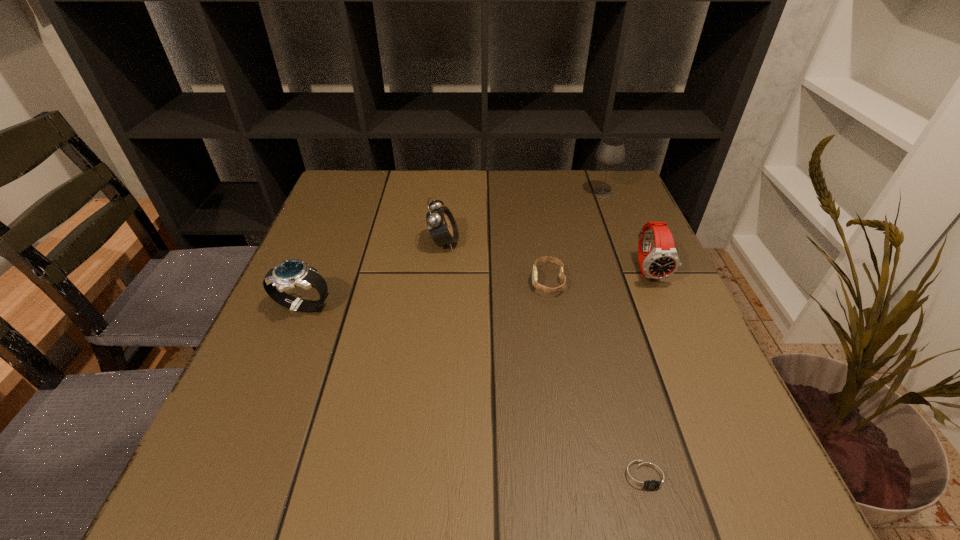
Locate an element on the screen. The height and width of the screenshot is (540, 960). wineglass that is at the right edge is located at coordinates (611, 152).

Locate an element on the screen. This screenshot has width=960, height=540. object that is at the far right corner is located at coordinates (611, 152).

This screenshot has width=960, height=540. I want to click on object present at the near right corner, so click(x=645, y=476).

Where is `vacant space at the far edge`? vacant space at the far edge is located at coordinates (495, 194).

Identify the location of free region at the near edge of the desktop. (541, 472).

At what (x,y) coordinates should I click in order to perform the action: click on vacant space at the left edge of the desktop. Please return your answer as a coordinate pair (x, y). This screenshot has height=540, width=960. Looking at the image, I should click on (311, 444).

In the image, there is a desktop. Identify the location of free space at the right edge. (672, 390).

At what (x,y) coordinates should I click in order to perform the action: click on vacant space at the far left corner of the desktop. Please return your answer as a coordinate pair (x, y). This screenshot has width=960, height=540. Looking at the image, I should click on (375, 199).

The image size is (960, 540). Identify the location of free space at the far right corner. (586, 171).

This screenshot has width=960, height=540. I want to click on free space between the shortest watch and the third object from left to right, so click(598, 379).